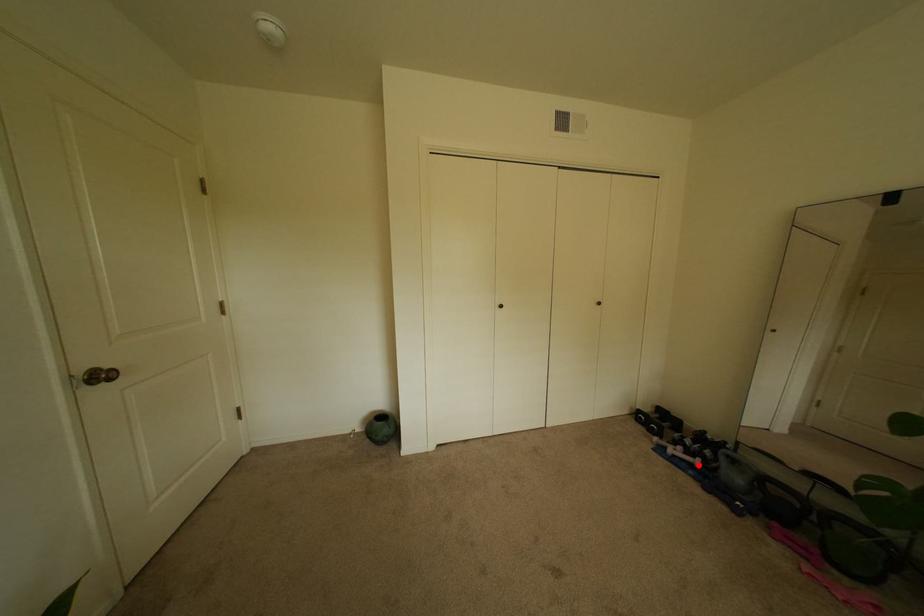
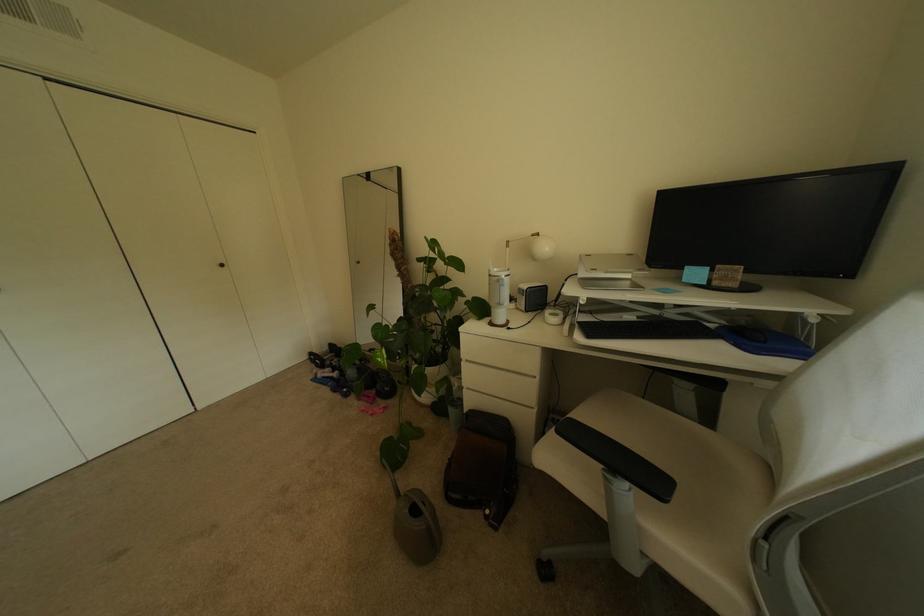
Question: A red point is marked in image1. In image2, is the corresponding 3D point closer to the camera or farther? Reply with the corresponding letter.

Choices:
 (A) The corresponding 3D point is closer.
 (B) The corresponding 3D point is farther.

Answer: (A)